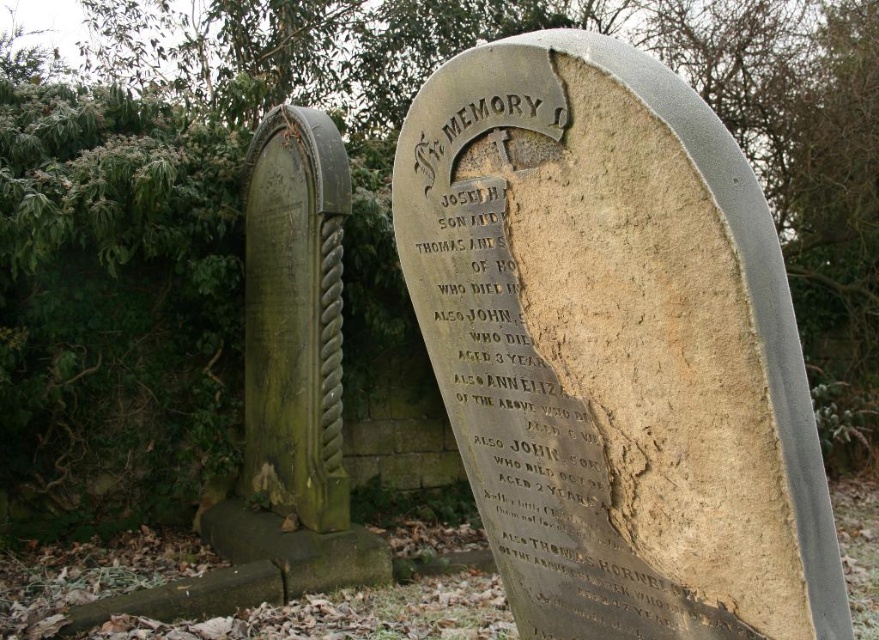
Does stone tombstone at center have a larger size compared to green stone monument at left?

No.

Can you confirm if stone tombstone at center is positioned to the right of green stone monument at left?

Correct, you'll find stone tombstone at center to the right of green stone monument at left.

You are a GUI agent. You are given a task and a screenshot of the screen. Output one action in this format:
    pyautogui.click(x=<x>, y=<y>)
    Task: Click on the stone tombstone at center
    
    Given the screenshot: What is the action you would take?
    pyautogui.click(x=614, y=348)

Where is `stone tombstone at center`? The width and height of the screenshot is (879, 640). stone tombstone at center is located at coordinates (614, 348).